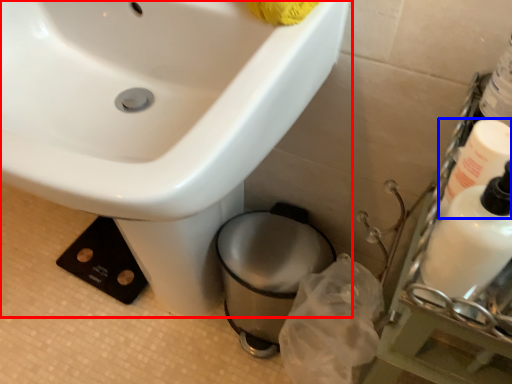
Question: Among these objects, which one is nearest to the camera, sink (highlighted by a red box) or cleaning product (highlighted by a blue box)?

Choices:
 (A) sink
 (B) cleaning product

Answer: (A)